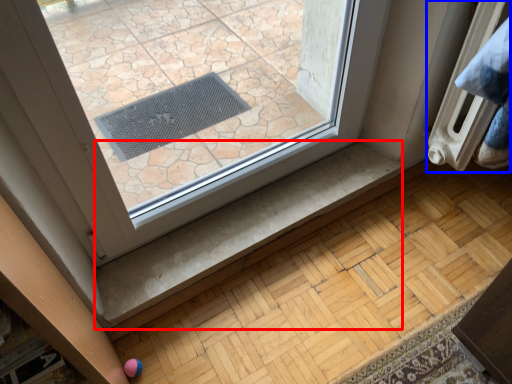
Question: Which object appears farthest to the camera in this image, stair (highlighted by a red box) or radiator (highlighted by a blue box)?

Choices:
 (A) stair
 (B) radiator

Answer: (A)